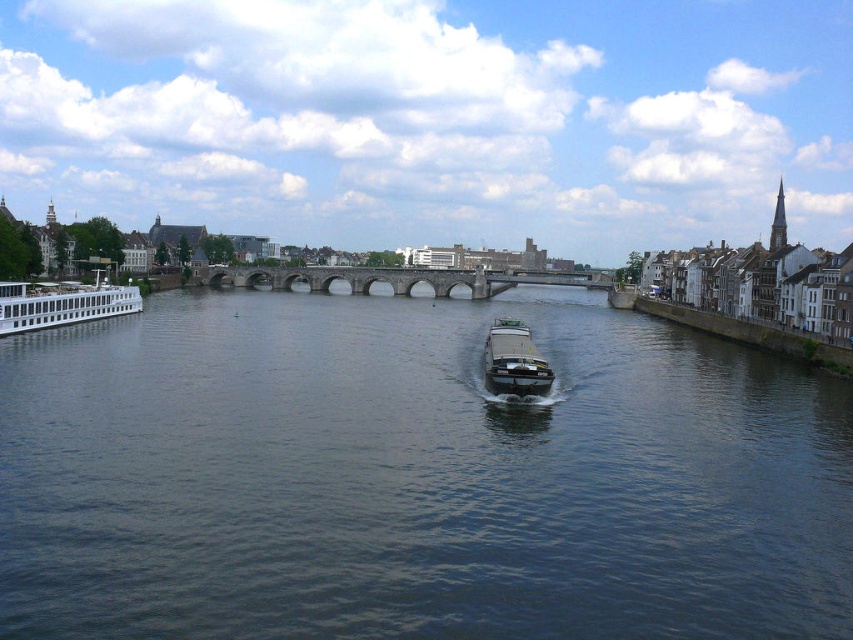
Which of these two, dark blue water at center or metallic gray barge at center, stands shorter?

metallic gray barge at center is shorter.

Does dark blue water at center appear under metallic gray barge at center?

Indeed, dark blue water at center is positioned under metallic gray barge at center.

Does point (698, 576) come farther from viewer compared to point (495, 348)?

No, (698, 576) is closer to viewer.

The height and width of the screenshot is (640, 853). What are the coordinates of `dark blue water at center` in the screenshot? It's located at (415, 476).

Identify the location of dark blue water at center. This screenshot has width=853, height=640. (415, 476).

Is dark blue water at center shorter than stone arch bridge at center?

No, dark blue water at center is not shorter than stone arch bridge at center.

Between point (350, 400) and point (264, 275), which one is positioned in front?

Point (350, 400) is in front.

Find the location of a particular element. The image size is (853, 640). dark blue water at center is located at coordinates (415, 476).

Does point (108, 282) come farther from viewer compared to point (526, 355)?

Yes, point (108, 282) is behind point (526, 355).

Does white glossy cruise ship at left have a smaller size compared to metallic gray barge at center?

Incorrect, white glossy cruise ship at left is not smaller in size than metallic gray barge at center.

What are the coordinates of `white glossy cruise ship at left` in the screenshot? It's located at (62, 304).